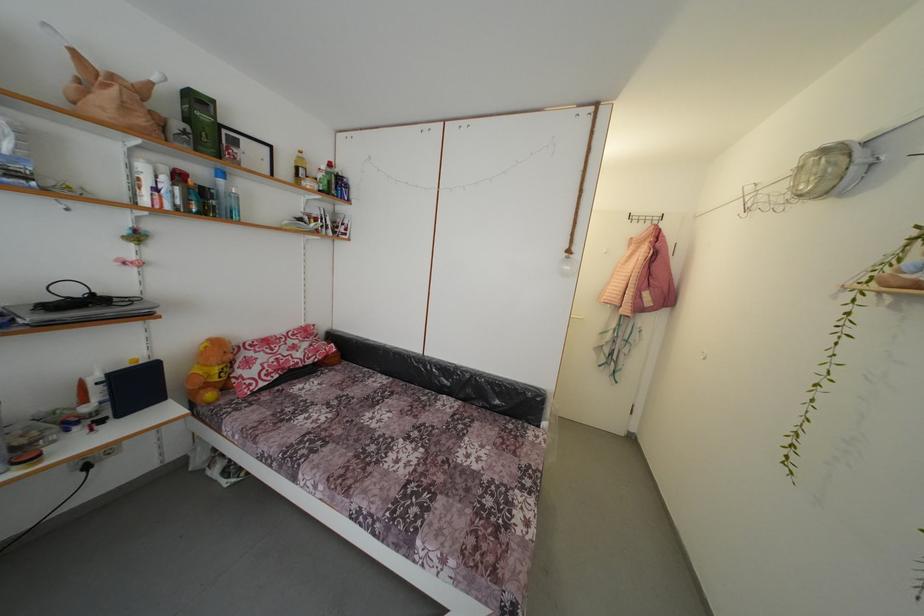
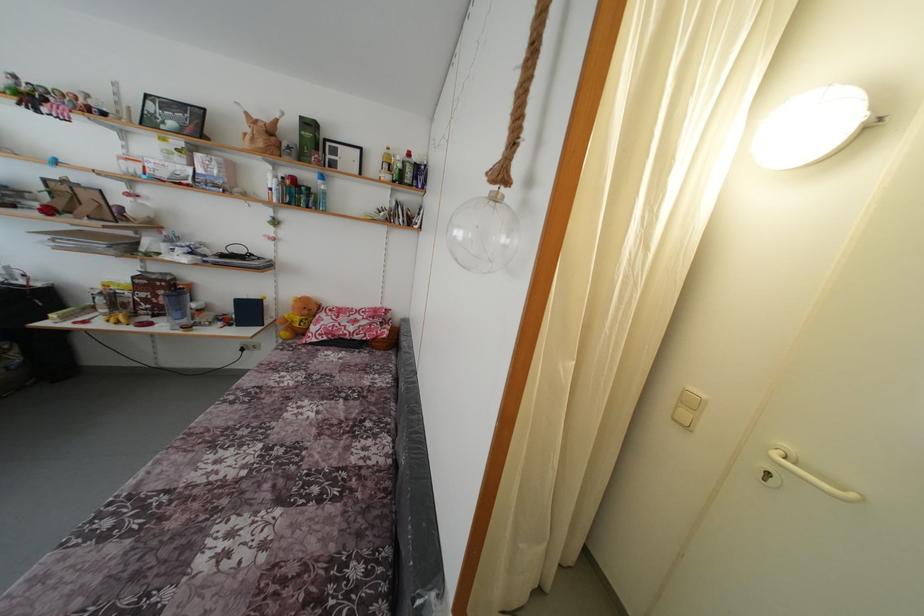
Locate, in the second image, the point that corresponds to point (225, 187) in the first image.

(324, 188)